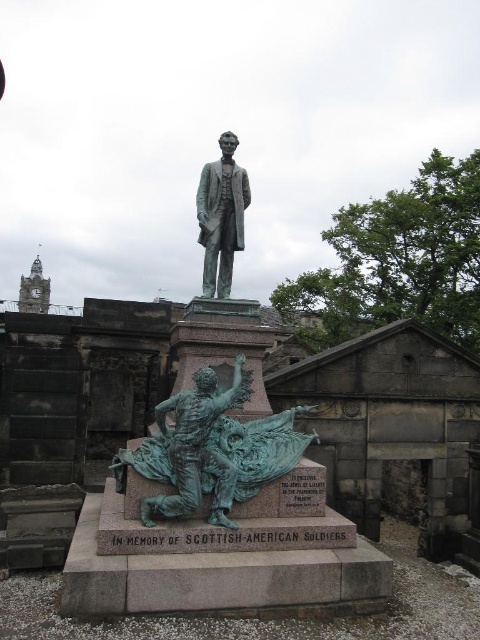
Question: Is green patina figure at center positioned behind bronze statue at center?

Choices:
 (A) no
 (B) yes

Answer: (A)

Question: Which point is farther to the camera?

Choices:
 (A) (189, 408)
 (B) (228, 202)

Answer: (B)

Question: Considering the relative positions of green patina figure at center and bronze statue at center in the image provided, where is green patina figure at center located with respect to bronze statue at center?

Choices:
 (A) right
 (B) left

Answer: (B)

Question: Is green patina figure at center in front of bronze statue at center?

Choices:
 (A) yes
 (B) no

Answer: (A)